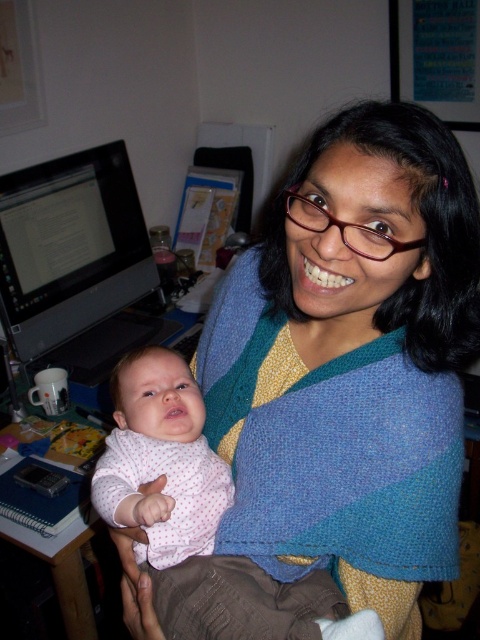
You are a photographer setting up a shot of the scene. You need to ensure that the pink dotted fabric at center and the matte black monitor at left are both in focus. Given that your camera has a depth of field that can cover 30 inches, will both objects be in focus?

The pink dotted fabric at center is 31.08 inches from the matte black monitor at left. Since the distance between them exceeds the camera lens depth of field of 30 inches, both objects may not be in focus simultaneously.

You are a fashion designer observing the image and want to create a new outfit combination. Which item is layered on top of the other between the blue knitted shawl at center and the pink dotted fabric at center?

Result: The blue knitted shawl at center is positioned over the pink dotted fabric at center, so it should be layered on top when creating the outfit combination.

From the picture: You are organizing a photo shoot and need to ensure the pink dotted fabric at center and the matte black monitor at left are both visible in the frame. Based on their positions, which object should be placed closer to the camera to ensure both are in focus?

The pink dotted fabric at center is in front of the matte black monitor at left, so to ensure both are in focus, the pink dotted fabric at center should remain closer to the camera while keeping the monitor slightly behind it within the depth of field.